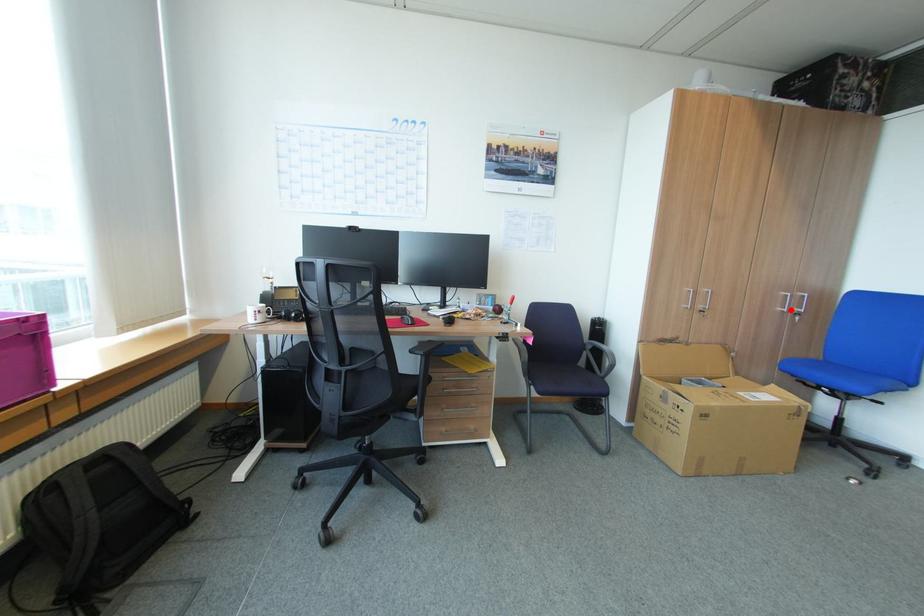
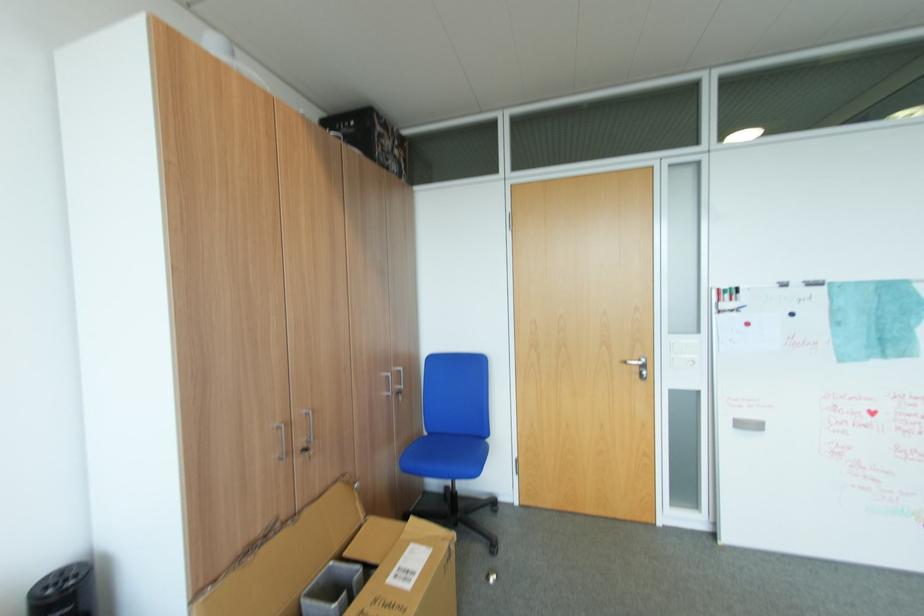
Locate, in the second image, the point that corresponds to the highlighted location in the first image.

(394, 394)